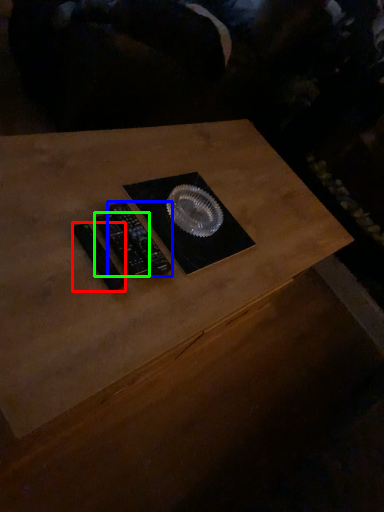
Question: Which object is positioned farthest from control (highlighted by a red box)? Select from control (highlighted by a blue box) and control (highlighted by a green box).

Choices:
 (A) control
 (B) control

Answer: (A)